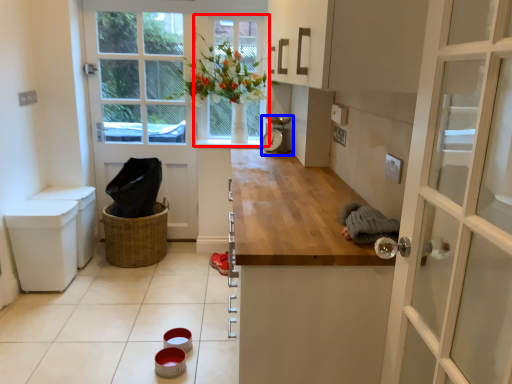
Question: Which object is closer to the camera taking this photo, window (highlighted by a red box) or appliance (highlighted by a blue box)?

Choices:
 (A) window
 (B) appliance

Answer: (B)